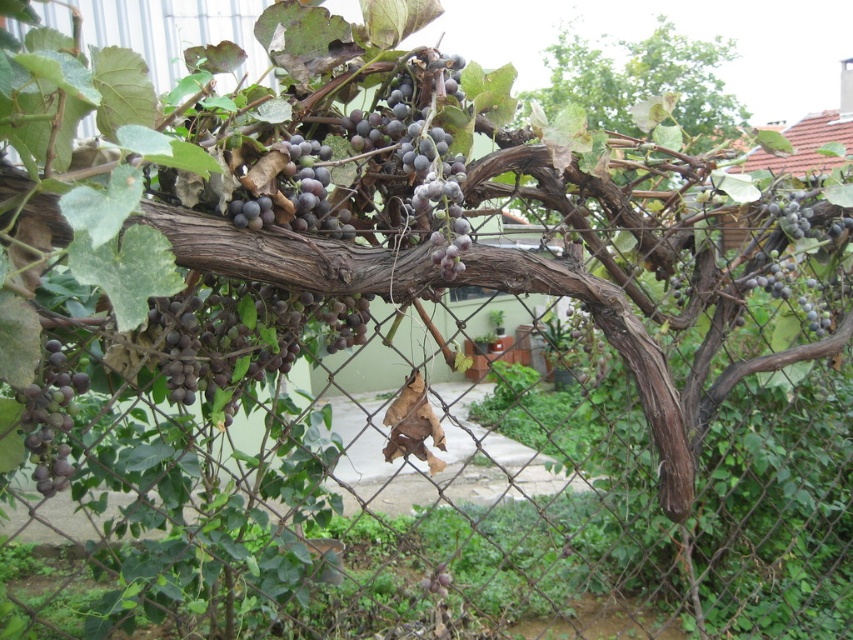
Is point (64, 410) in front of point (779, 208)?

Yes, it is in front of point (779, 208).

Who is positioned more to the right, purple matte grapes at lower left or dark purple grapes at upper right?

dark purple grapes at upper right is more to the right.

You are a GUI agent. You are given a task and a screenshot of the screen. Output one action in this format:
    pyautogui.click(x=<x>, y=<y>)
    Task: Click on the purple matte grapes at lower left
    This screenshot has width=853, height=640.
    Given the screenshot: What is the action you would take?
    click(50, 419)

This screenshot has height=640, width=853. Identify the location of purple matte grapes at lower left. (50, 419).

Does green leafy tree at upper center have a lesser height compared to dark purple grapes at upper right?

In fact, green leafy tree at upper center may be taller than dark purple grapes at upper right.

Does green leafy tree at upper center have a greater width compared to dark purple grapes at upper right?

Yes.

This screenshot has width=853, height=640. I want to click on green leafy tree at upper center, so click(643, 81).

Is green leafy tree at upper center wider than purple matte grapes at lower left?

Indeed, green leafy tree at upper center has a greater width compared to purple matte grapes at lower left.

Does green leafy tree at upper center appear over purple matte grapes at lower left?

Correct, green leafy tree at upper center is located above purple matte grapes at lower left.

Locate an element on the screen. The image size is (853, 640). green leafy tree at upper center is located at coordinates (643, 81).

Locate an element on the screen. The width and height of the screenshot is (853, 640). green leafy tree at upper center is located at coordinates (643, 81).